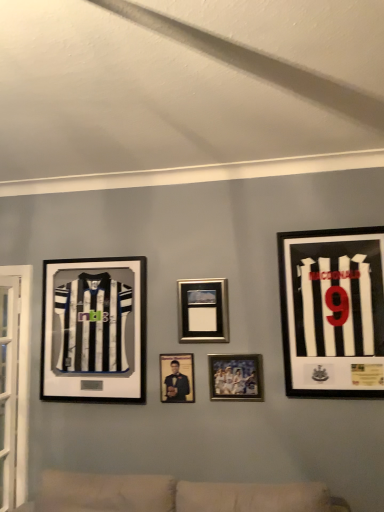
Measure the distance between metallic silver photo frame at center, which appears as the 3th picture frame when viewed from the left, and camera.

A distance of 8.49 feet exists between metallic silver photo frame at center, which appears as the 3th picture frame when viewed from the left, and camera.

Describe the element at coordinates (94, 330) in the screenshot. The width and height of the screenshot is (384, 512). I see `black matte jersey at left, the 1th picture frame positioned from the left` at that location.

Find the location of `metallic silver photo frame at center, which appears as the 3th picture frame when viewed from the left`. metallic silver photo frame at center, which appears as the 3th picture frame when viewed from the left is located at coordinates (203, 310).

Which of these two, black matte jersey at right, acting as the fifth picture frame starting from the left, or metallic silver photo frame at center, marked as the second picture frame in a right-to-left arrangement, stands taller?

With more height is black matte jersey at right, acting as the fifth picture frame starting from the left.

From the image's perspective, is black matte jersey at right, acting as the fifth picture frame starting from the left, located above or below metallic silver photo frame at center, marked as the second picture frame in a right-to-left arrangement?

Based on their image positions, black matte jersey at right, acting as the fifth picture frame starting from the left, is located above metallic silver photo frame at center, marked as the second picture frame in a right-to-left arrangement.

Visually, is black matte jersey at right, acting as the fifth picture frame starting from the left, positioned to the left or to the right of metallic silver photo frame at center, marked as the second picture frame in a right-to-left arrangement?

From the image, it's evident that black matte jersey at right, acting as the fifth picture frame starting from the left, is to the right of metallic silver photo frame at center, marked as the second picture frame in a right-to-left arrangement.

Is black matte jersey at right, acting as the fifth picture frame starting from the left, spatially inside metallic silver photo frame at center, marked as the second picture frame in a right-to-left arrangement, or outside of it?

black matte jersey at right, acting as the fifth picture frame starting from the left, exists outside the volume of metallic silver photo frame at center, marked as the second picture frame in a right-to-left arrangement.

Based on their sizes in the image, would you say metallic silver photo frame at center, acting as the third picture frame starting from the right, is bigger or smaller than matte black photo frame at center, the second picture frame viewed from the left?

Clearly, metallic silver photo frame at center, acting as the third picture frame starting from the right, is larger in size than matte black photo frame at center, the second picture frame viewed from the left.

Is metallic silver photo frame at center, which appears as the 3th picture frame when viewed from the left, wider or thinner than matte black photo frame at center, the fourth picture frame when ordered from right to left?

metallic silver photo frame at center, which appears as the 3th picture frame when viewed from the left, is wider than matte black photo frame at center, the fourth picture frame when ordered from right to left.

Which is closer, (199, 339) or (193, 384)?

The point (193, 384) is in front.

Can we say metallic silver photo frame at center, acting as the third picture frame starting from the right, lies outside matte black photo frame at center, the fourth picture frame when ordered from right to left?

Yes.

From a real-world perspective, between black matte jersey at left, placed as the fifth picture frame when sorted from right to left, and black matte jersey at right, acting as the fifth picture frame starting from the left, who is vertically lower?

black matte jersey at left, placed as the fifth picture frame when sorted from right to left, is physically lower.

From the image's perspective, who appears lower, black matte jersey at left, the 1th picture frame positioned from the left, or black matte jersey at right, the 1th picture frame from the right?

black matte jersey at left, the 1th picture frame positioned from the left, appears lower in the image.

Is black matte jersey at left, the 1th picture frame positioned from the left, inside the boundaries of black matte jersey at right, acting as the fifth picture frame starting from the left, or outside?

black matte jersey at left, the 1th picture frame positioned from the left, is located beyond the bounds of black matte jersey at right, acting as the fifth picture frame starting from the left.

Consider the image. Does matte black photo frame at center, the second picture frame viewed from the left, have a greater width compared to metallic silver photo frame at center, acting as the third picture frame starting from the right?

Incorrect, the width of matte black photo frame at center, the second picture frame viewed from the left, does not surpass that of metallic silver photo frame at center, acting as the third picture frame starting from the right.

Does matte black photo frame at center, the second picture frame viewed from the left, have a larger size compared to metallic silver photo frame at center, which appears as the 3th picture frame when viewed from the left?

Incorrect, matte black photo frame at center, the second picture frame viewed from the left, is not larger than metallic silver photo frame at center, which appears as the 3th picture frame when viewed from the left.

Is matte black photo frame at center, the fourth picture frame when ordered from right to left, looking in the opposite direction of metallic silver photo frame at center, acting as the third picture frame starting from the right?

matte black photo frame at center, the fourth picture frame when ordered from right to left, is not turned away from metallic silver photo frame at center, acting as the third picture frame starting from the right.

Between point (167, 380) and point (208, 322), which one is positioned behind?

Positioned behind is point (167, 380).

Is metallic silver photo frame at center, the 4th picture frame viewed from the left, in contact with black matte jersey at left, the 1th picture frame positioned from the left?

No, metallic silver photo frame at center, the 4th picture frame viewed from the left, is not in contact with black matte jersey at left, the 1th picture frame positioned from the left.

Is metallic silver photo frame at center, the 4th picture frame viewed from the left, completely or partially outside of black matte jersey at left, the 1th picture frame positioned from the left?

metallic silver photo frame at center, the 4th picture frame viewed from the left, lies outside black matte jersey at left, the 1th picture frame positioned from the left,'s area.

From the image's perspective, which is below, black matte jersey at left, the 1th picture frame positioned from the left, or matte black photo frame at center, the fourth picture frame when ordered from right to left?

matte black photo frame at center, the fourth picture frame when ordered from right to left, from the image's perspective.

Does black matte jersey at left, placed as the fifth picture frame when sorted from right to left, turn towards matte black photo frame at center, the fourth picture frame when ordered from right to left?

No, black matte jersey at left, placed as the fifth picture frame when sorted from right to left, is not aimed at matte black photo frame at center, the fourth picture frame when ordered from right to left.

Between black matte jersey at left, placed as the fifth picture frame when sorted from right to left, and matte black photo frame at center, the fourth picture frame when ordered from right to left, which one has smaller width?

matte black photo frame at center, the fourth picture frame when ordered from right to left, is thinner.

Does black matte jersey at left, placed as the fifth picture frame when sorted from right to left, touch matte black photo frame at center, the second picture frame viewed from the left?

black matte jersey at left, placed as the fifth picture frame when sorted from right to left, and matte black photo frame at center, the second picture frame viewed from the left, are clearly separated.

Does metallic silver photo frame at center, marked as the second picture frame in a right-to-left arrangement, contain black matte jersey at right, the 1th picture frame from the right?

Actually, black matte jersey at right, the 1th picture frame from the right, is outside metallic silver photo frame at center, marked as the second picture frame in a right-to-left arrangement.

Considering the sizes of metallic silver photo frame at center, the 4th picture frame viewed from the left, and black matte jersey at right, acting as the fifth picture frame starting from the left, in the image, is metallic silver photo frame at center, the 4th picture frame viewed from the left, bigger or smaller than black matte jersey at right, acting as the fifth picture frame starting from the left,?

In the image, metallic silver photo frame at center, the 4th picture frame viewed from the left, appears to be smaller than black matte jersey at right, acting as the fifth picture frame starting from the left.

Can you confirm if metallic silver photo frame at center, the 4th picture frame viewed from the left, is thinner than black matte jersey at right, acting as the fifth picture frame starting from the left?

Indeed, metallic silver photo frame at center, the 4th picture frame viewed from the left, has a lesser width compared to black matte jersey at right, acting as the fifth picture frame starting from the left.

In the image, is metallic silver photo frame at center, marked as the second picture frame in a right-to-left arrangement, positioned in front of or behind black matte jersey at right, the 1th picture frame from the right?

metallic silver photo frame at center, marked as the second picture frame in a right-to-left arrangement, is positioned farther from the viewer than black matte jersey at right, the 1th picture frame from the right.

Where is `picture frame that is the 2nd one above the metallic silver photo frame at center, marked as the second picture frame in a right-to-left arrangement (from a real-world perspective)`? The image size is (384, 512). picture frame that is the 2nd one above the metallic silver photo frame at center, marked as the second picture frame in a right-to-left arrangement (from a real-world perspective) is located at coordinates (333, 312).

The image size is (384, 512). There is a metallic silver photo frame at center, which appears as the 3th picture frame when viewed from the left. In order to click on the 4th picture frame below it (from a real-world perspective) in this screenshot , I will do `click(177, 378)`.

Based on their spatial positions, is matte black photo frame at center, the fourth picture frame when ordered from right to left, or black matte jersey at left, the 1th picture frame positioned from the left, further from metallic silver photo frame at center, acting as the third picture frame starting from the right?

The object further to metallic silver photo frame at center, acting as the third picture frame starting from the right, is black matte jersey at left, the 1th picture frame positioned from the left.

Looking at the image, which one is located further to black matte jersey at left, the 1th picture frame positioned from the left, metallic silver photo frame at center, marked as the second picture frame in a right-to-left arrangement, or black matte jersey at right, the 1th picture frame from the right?

The object further to black matte jersey at left, the 1th picture frame positioned from the left, is black matte jersey at right, the 1th picture frame from the right.

Based on their spatial positions, is matte black photo frame at center, the fourth picture frame when ordered from right to left, or metallic silver photo frame at center, which appears as the 3th picture frame when viewed from the left, further from black matte jersey at left, placed as the fifth picture frame when sorted from right to left?

The object further to black matte jersey at left, placed as the fifth picture frame when sorted from right to left, is metallic silver photo frame at center, which appears as the 3th picture frame when viewed from the left.

Looking at the image, which one is located closer to black matte jersey at right, acting as the fifth picture frame starting from the left, metallic silver photo frame at center, the 4th picture frame viewed from the left, or metallic silver photo frame at center, which appears as the 3th picture frame when viewed from the left?

metallic silver photo frame at center, the 4th picture frame viewed from the left, is closer to black matte jersey at right, acting as the fifth picture frame starting from the left.

When comparing their distances from metallic silver photo frame at center, which appears as the 3th picture frame when viewed from the left, does black matte jersey at left, placed as the fifth picture frame when sorted from right to left, or matte black photo frame at center, the second picture frame viewed from the left, seem closer?

The object closer to metallic silver photo frame at center, which appears as the 3th picture frame when viewed from the left, is matte black photo frame at center, the second picture frame viewed from the left.

When comparing their distances from metallic silver photo frame at center, the 4th picture frame viewed from the left, does matte black photo frame at center, the second picture frame viewed from the left, or metallic silver photo frame at center, acting as the third picture frame starting from the right, seem further?

The object further to metallic silver photo frame at center, the 4th picture frame viewed from the left, is metallic silver photo frame at center, acting as the third picture frame starting from the right.

Which object lies further to the anchor point black matte jersey at right, acting as the fifth picture frame starting from the left, black matte jersey at left, the 1th picture frame positioned from the left, or metallic silver photo frame at center, marked as the second picture frame in a right-to-left arrangement?

black matte jersey at left, the 1th picture frame positioned from the left, lies further to black matte jersey at right, acting as the fifth picture frame starting from the left, than the other object.

Which object lies nearer to the anchor point metallic silver photo frame at center, marked as the second picture frame in a right-to-left arrangement, metallic silver photo frame at center, acting as the third picture frame starting from the right, or matte black photo frame at center, the second picture frame viewed from the left?

matte black photo frame at center, the second picture frame viewed from the left, is closer to metallic silver photo frame at center, marked as the second picture frame in a right-to-left arrangement.

Where is `picture frame between metallic silver photo frame at center, acting as the third picture frame starting from the right, and black matte jersey at right, acting as the fifth picture frame starting from the left`? The width and height of the screenshot is (384, 512). picture frame between metallic silver photo frame at center, acting as the third picture frame starting from the right, and black matte jersey at right, acting as the fifth picture frame starting from the left is located at coordinates (236, 377).

What are the coordinates of `picture frame situated between black matte jersey at left, placed as the fifth picture frame when sorted from right to left, and metallic silver photo frame at center, acting as the third picture frame starting from the right, from left to right` in the screenshot? It's located at [x=177, y=378].